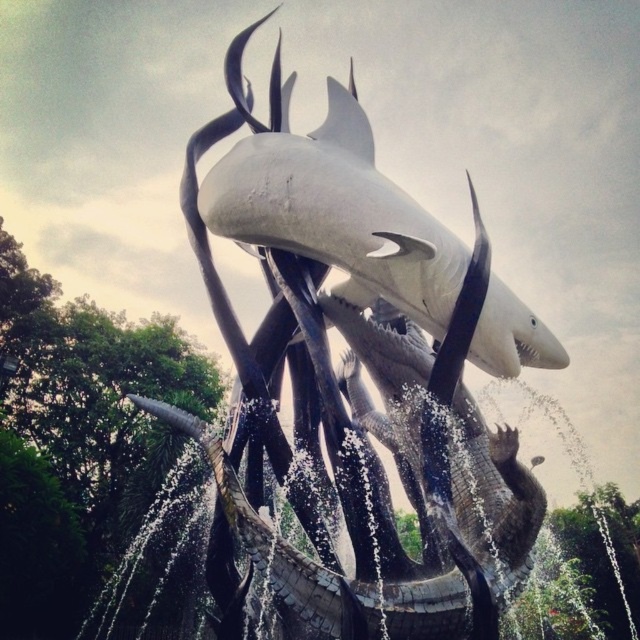
Question: Can you confirm if white glossy shark at center is positioned below white matte shark at upper center?

Choices:
 (A) yes
 (B) no

Answer: (A)

Question: Which object is farther from the camera taking this photo?

Choices:
 (A) white matte shark at upper center
 (B) white glossy shark at center

Answer: (A)

Question: Considering the relative positions of white glossy shark at center and white matte shark at upper center in the image provided, where is white glossy shark at center located with respect to white matte shark at upper center?

Choices:
 (A) left
 (B) right

Answer: (A)

Question: Which point appears closest to the camera in this image?

Choices:
 (A) (435, 372)
 (B) (346, 257)

Answer: (A)

Question: Does white glossy shark at center lie behind white matte shark at upper center?

Choices:
 (A) no
 (B) yes

Answer: (A)